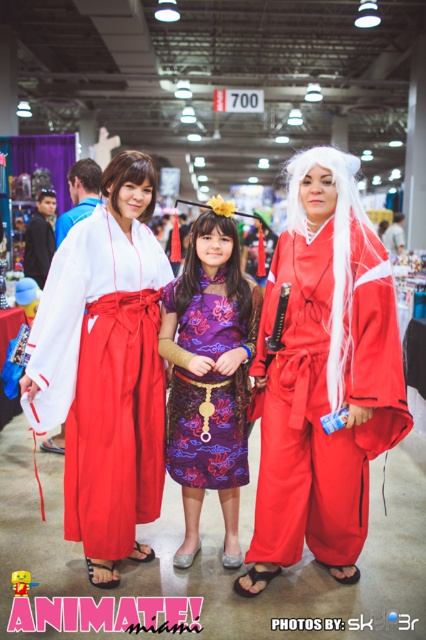
Question: Which is farther from the purple satin dress at center?

Choices:
 (A) matte red kimono at center
 (B) white cotton kimono at center
 (C) white satin kimono at center

Answer: (C)

Question: Which of the following is the farthest from the observer?

Choices:
 (A) white cotton kimono at center
 (B) matte red kimono at center
 (C) white satin kimono at center
 (D) purple satin dress at center

Answer: (C)

Question: Does purple satin dress at center appear over white satin kimono at center?

Choices:
 (A) yes
 (B) no

Answer: (B)

Question: Does white cotton kimono at center appear on the left side of purple satin dress at center?

Choices:
 (A) no
 (B) yes

Answer: (B)

Question: Can you confirm if matte red kimono at center is thinner than purple satin dress at center?

Choices:
 (A) no
 (B) yes

Answer: (A)

Question: Estimate the real-world distances between objects in this image. Which object is closer to the matte red kimono at center?

Choices:
 (A) purple satin dress at center
 (B) white cotton kimono at center
 (C) white satin kimono at center

Answer: (A)